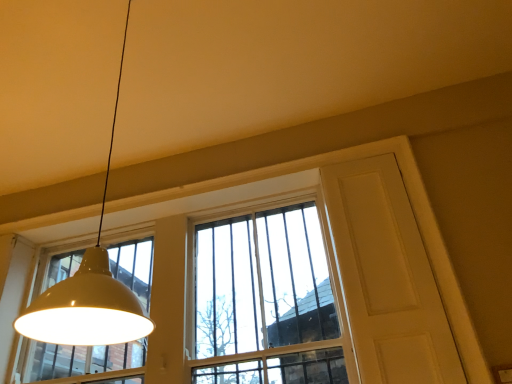
Question: Should I look upward or downward to see white glossy lampshade at upper left?

Choices:
 (A) up
 (B) down

Answer: (A)

Question: Is the position of white matte screen door at upper right less distant than that of clear glass window at center?

Choices:
 (A) yes
 (B) no

Answer: (A)

Question: Is white matte screen door at upper right not within clear glass window at center?

Choices:
 (A) yes
 (B) no

Answer: (A)

Question: Is white matte screen door at upper right oriented towards clear glass window at center?

Choices:
 (A) no
 (B) yes

Answer: (A)

Question: From a real-world perspective, is white matte screen door at upper right located higher than clear glass window at center?

Choices:
 (A) yes
 (B) no

Answer: (B)

Question: Does white matte screen door at upper right have a greater height compared to clear glass window at center?

Choices:
 (A) yes
 (B) no

Answer: (A)

Question: Is white matte screen door at upper right not near clear glass window at center?

Choices:
 (A) no
 (B) yes

Answer: (A)

Question: Is clear glass window at center at the left side of white glossy lampshade at upper left?

Choices:
 (A) yes
 (B) no

Answer: (A)

Question: Is clear glass window at center further to the viewer compared to white glossy lampshade at upper left?

Choices:
 (A) no
 (B) yes

Answer: (B)

Question: Can you confirm if clear glass window at center is bigger than white glossy lampshade at upper left?

Choices:
 (A) no
 (B) yes

Answer: (B)

Question: Is white glossy lampshade at upper left at the back of clear glass window at center?

Choices:
 (A) no
 (B) yes

Answer: (A)

Question: Is white glossy lampshade at upper left inside clear glass window at center?

Choices:
 (A) no
 (B) yes

Answer: (A)

Question: Is clear glass window at center far away from white glossy lampshade at upper left?

Choices:
 (A) no
 (B) yes

Answer: (B)

Question: From a real-world perspective, is white glossy lampshade at upper left physically above white matte screen door at upper right?

Choices:
 (A) no
 (B) yes

Answer: (B)